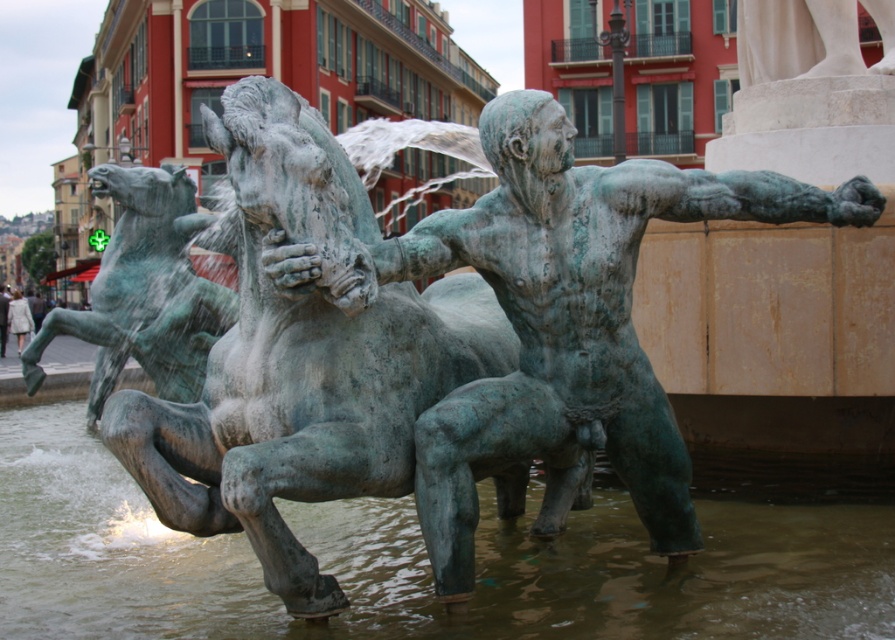
Question: Among these objects, which one is farthest from the camera?

Choices:
 (A) green patina statue at center
 (B) greenish water at horse front

Answer: (A)

Question: Does green patina statue at center appear on the right side of green patina horse at left?

Choices:
 (A) no
 (B) yes

Answer: (B)

Question: Which point is farther to the camera?

Choices:
 (A) (467, 362)
 (B) (173, 625)

Answer: (A)

Question: Is greenish water at horse front below green patina horse at left?

Choices:
 (A) no
 (B) yes

Answer: (B)

Question: Does green patina bronze statue at center appear on the right side of green patina horse at left?

Choices:
 (A) yes
 (B) no

Answer: (A)

Question: Among these points, which one is nearest to the camera?

Choices:
 (A) (590, 508)
 (B) (232, 323)

Answer: (A)